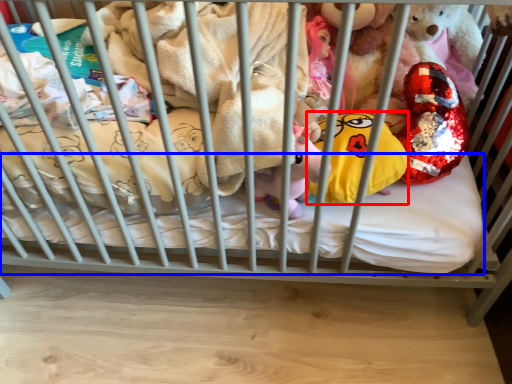
Question: Which point is further to the camera, pillow (highlighted by a red box) or mattress (highlighted by a blue box)?

Choices:
 (A) pillow
 (B) mattress

Answer: (B)